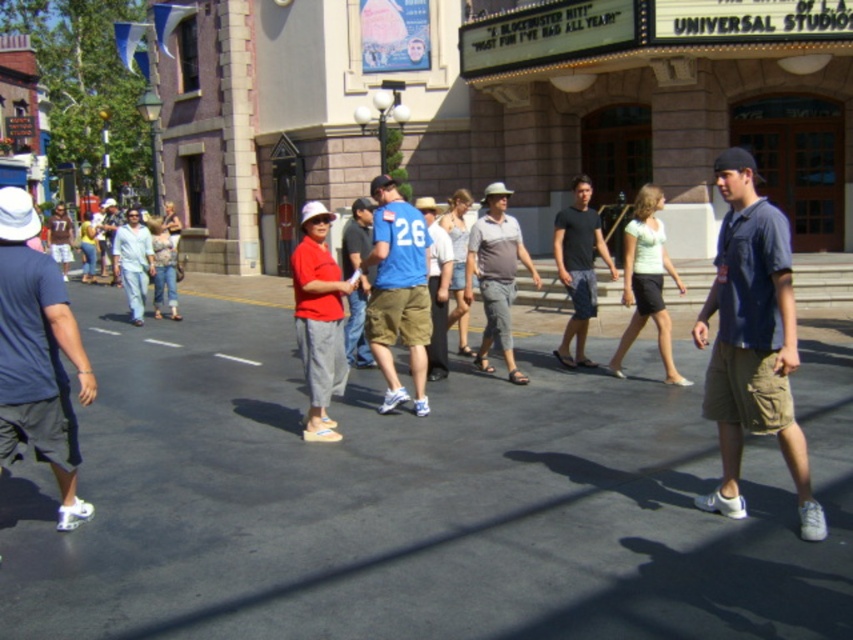
You are a Universal Studios tour guide who needs to walk from the blue fabric shirt at center to the light blue jeans at center. The tour requires you to maintain a minimum distance of 30 feet between guests for safety. Can you proceed without violating the safety guidelines?

The distance between the blue fabric shirt at center and the light blue jeans at center is 28.80 feet. Since this is less than the required 30 feet, proceeding would violate the safety guidelines.

You are standing in the Universal Studios street scene and need to walk to a specific location. You have two points marked on the ground in front of you. The first point is at coordinates point [402,218] and the second point is at point [122,273]. Which point should you step on first if you want to reach the one closer to you?

You should step on point [402,218] first because it is closer to you than point [122,273].

You are a photographer standing on the Universal Studios street, and you want to capture a photo of the blue denim shirt at center and the light blue jeans at center. Since you want both items to be clearly visible, which one should you focus on first to ensure proper framing?

The blue denim shirt at center is wider than the light blue jeans at center, so you should focus on the blue denim shirt at center first to ensure proper framing.